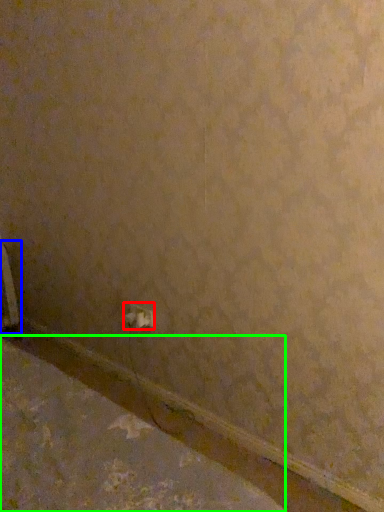
Question: Which object is positioned closest to power plugs and sockets (highlighted by a red box)? Select from radiator (highlighted by a blue box) and concrete (highlighted by a green box).

Choices:
 (A) radiator
 (B) concrete

Answer: (B)